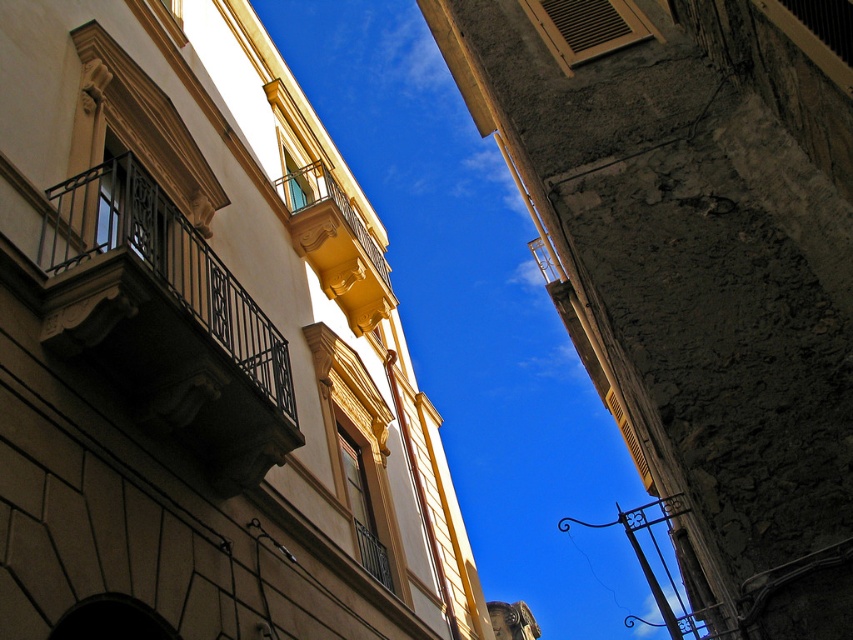
Question: Which of the following is the closest to the observer?

Choices:
 (A) black wrought iron balcony at left
 (B) rough concrete wall at upper right

Answer: (B)

Question: Does rough concrete wall at upper right have a smaller size compared to black wrought iron balcony at left?

Choices:
 (A) yes
 (B) no

Answer: (B)

Question: Does rough concrete wall at upper right appear under black wrought iron balcony at left?

Choices:
 (A) yes
 (B) no

Answer: (A)

Question: Is rough concrete wall at upper right wider than black wrought iron balcony at left?

Choices:
 (A) yes
 (B) no

Answer: (A)

Question: Which object appears closest to the camera in this image?

Choices:
 (A) black wrought iron balcony at left
 (B) rough concrete wall at upper right

Answer: (B)